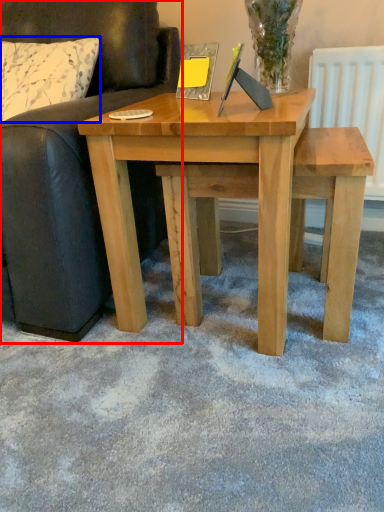
Question: Which of the following is the closest to the observer, studio couch (highlighted by a red box) or pillow (highlighted by a blue box)?

Choices:
 (A) studio couch
 (B) pillow

Answer: (A)